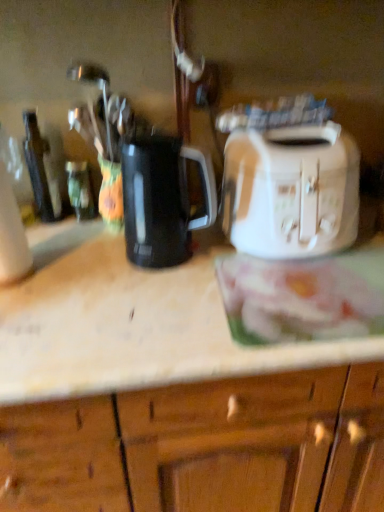
This screenshot has height=512, width=384. I want to click on free space in front of white plastic toaster at right, so click(x=287, y=301).